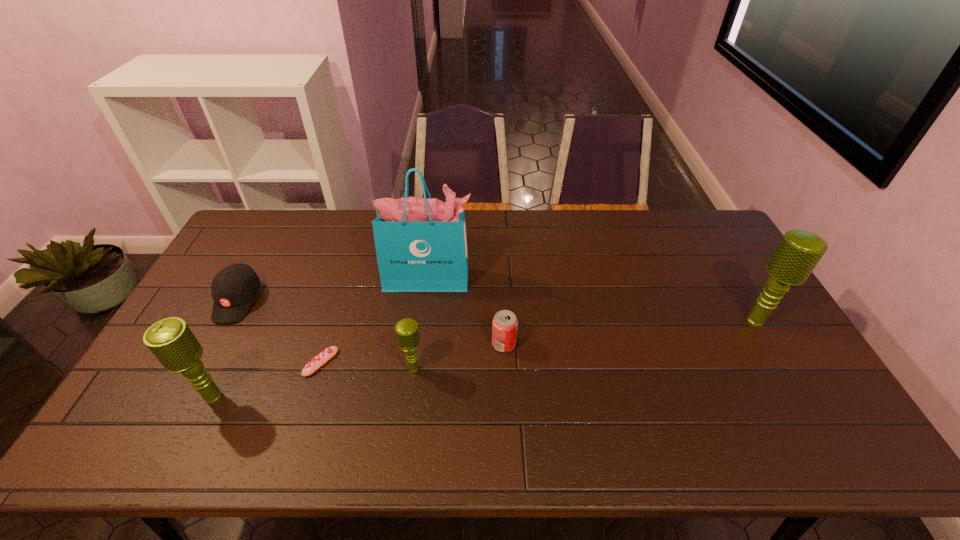
Image resolution: width=960 pixels, height=540 pixels. Identify the location of baseball cap that is positioned at the left edge. (234, 288).

This screenshot has width=960, height=540. Identify the location of object that is at the right edge. (798, 253).

Locate an element on the screen. This screenshot has width=960, height=540. object situated at the near left corner is located at coordinates [171, 341].

You are a GUI agent. You are given a task and a screenshot of the screen. Output one action in this format:
    pyautogui.click(x=<x>, y=<y>)
    Task: Click on the free region at the far edge
    This screenshot has height=540, width=960.
    Given the screenshot: What is the action you would take?
    pyautogui.click(x=500, y=212)

In the image, there is a desktop. Where is `vacant space at the near edge`? Image resolution: width=960 pixels, height=540 pixels. vacant space at the near edge is located at coordinates (667, 412).

This screenshot has height=540, width=960. In order to click on free location at the left edge of the desktop in this screenshot , I will do (x=253, y=252).

Where is `vacant space at the right edge`? This screenshot has height=540, width=960. vacant space at the right edge is located at coordinates (716, 295).

Find the location of a particular element. This screenshot has width=960, height=540. free space between the tallest object and the farthest microphone is located at coordinates (592, 300).

Identify the location of vacant point located between the soda can and the shopping bag. This screenshot has height=540, width=960. (467, 312).

This screenshot has width=960, height=540. Identify the location of free spot between the eclair and the second shortest object. (279, 332).